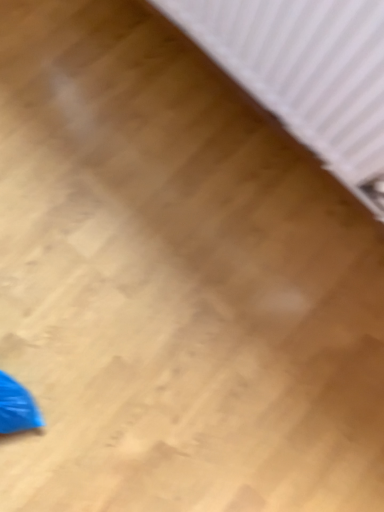
You are a GUI agent. You are given a task and a screenshot of the screen. Output one action in this format:
    pyautogui.click(x=<x>, y=<y>)
    Task: Click on the free space in front of white textured radiator at upper right
    Image resolution: width=384 pixels, height=512 pixels.
    Given the screenshot: What is the action you would take?
    pyautogui.click(x=173, y=265)